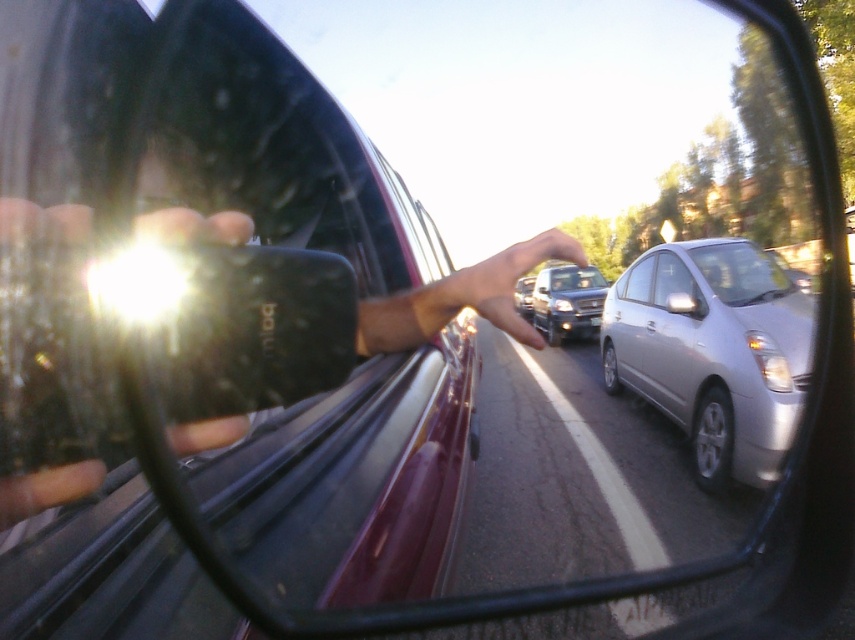
Question: Which point appears closest to the camera in this image?

Choices:
 (A) (80, 474)
 (B) (684, 275)
 (C) (529, 308)

Answer: (A)

Question: In this image, where is silver metallic car at center located relative to metallic silver sedan at center?

Choices:
 (A) right
 (B) left

Answer: (B)

Question: Does matte black hand at center appear over clear glass windshield at center?

Choices:
 (A) no
 (B) yes

Answer: (A)

Question: In this image, where is matte black hand at center located relative to satin silver car window at center?

Choices:
 (A) left
 (B) right

Answer: (A)

Question: Estimate the real-world distances between objects in this image. Which object is closer to the matte black hand at center?

Choices:
 (A) silver metallic car at center
 (B) silver metallic sedan at center
 (C) clear glass windshield at center
 (D) metallic silver sedan at center

Answer: (B)

Question: Among these objects, which one is farthest from the camera?

Choices:
 (A) silver metallic car at center
 (B) clear glass windshield at center
 (C) satin silver car window at center
 (D) silver metallic sedan at center

Answer: (C)